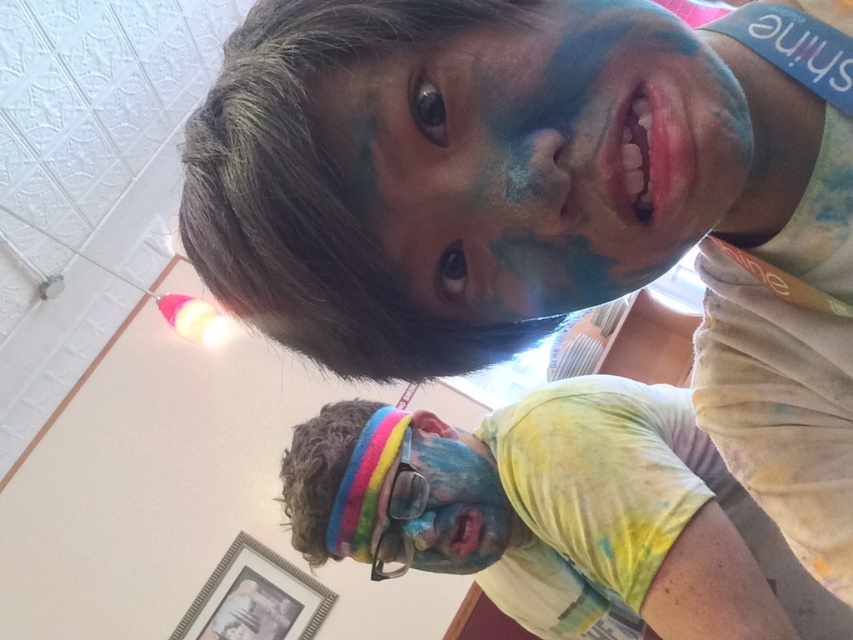
Does point (677, 257) come farther from viewer compared to point (444, 529)?

No.

Based on the photo, can you confirm if blue matte face at upper center is positioned below matte multicolored face at lower center?

No.

Which is behind, point (399, 196) or point (468, 506)?

The point (468, 506) is behind.

The height and width of the screenshot is (640, 853). I want to click on blue matte face at upper center, so (541, 156).

Looking at this image, is rainbow tie-dye shirt at lower right thinner than matte multicolored face at lower center?

No, rainbow tie-dye shirt at lower right is not thinner than matte multicolored face at lower center.

Which of these two, rainbow tie-dye shirt at lower right or matte multicolored face at lower center, stands taller?

rainbow tie-dye shirt at lower right is taller.

The width and height of the screenshot is (853, 640). Describe the element at coordinates (563, 515) in the screenshot. I see `rainbow tie-dye shirt at lower right` at that location.

Find the location of a particular element. rainbow tie-dye shirt at lower right is located at coordinates (563, 515).

The width and height of the screenshot is (853, 640). I want to click on blue matte face at upper center, so click(x=541, y=156).

Locate an element on the screen. This screenshot has width=853, height=640. blue matte face at upper center is located at coordinates (541, 156).

At what (x,y) coordinates should I click in order to perform the action: click on blue matte face at upper center. Please return your answer as a coordinate pair (x, y). Looking at the image, I should click on (541, 156).